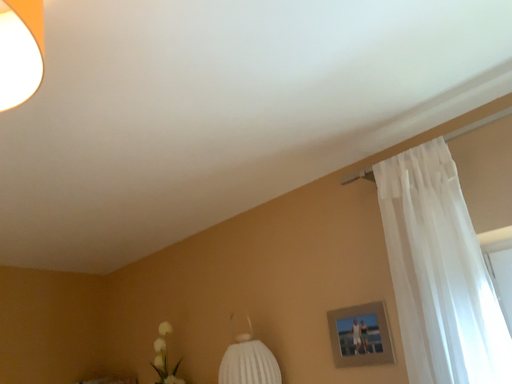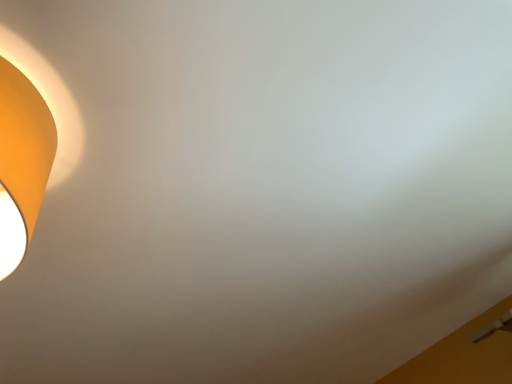
Question: How did the camera likely rotate when shooting the video?

Choices:
 (A) rotated upward
 (B) rotated downward

Answer: (A)